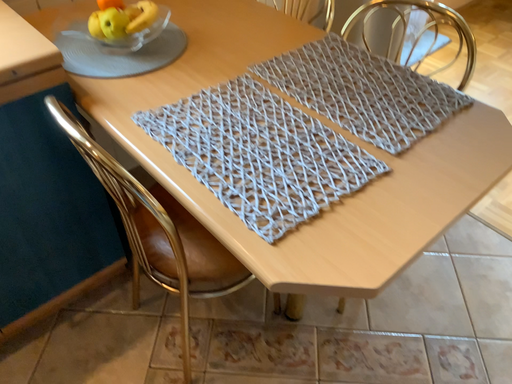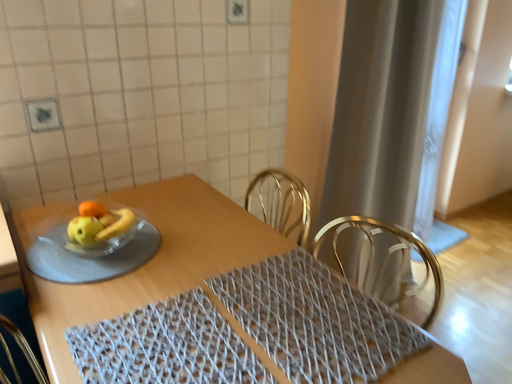
Question: Which way did the camera rotate in the video?

Choices:
 (A) rotated upward
 (B) rotated downward

Answer: (A)